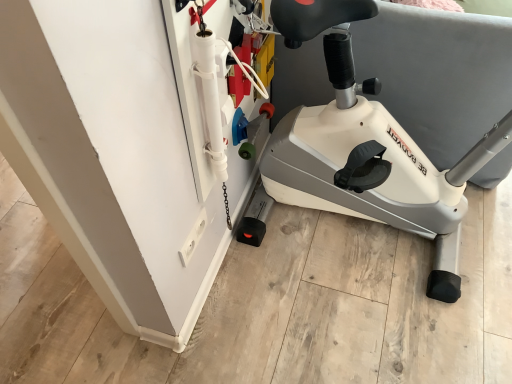
Image resolution: width=512 pixels, height=384 pixels. What do you see at coordinates (367, 149) in the screenshot? I see `white plastic stationary bicycle at center` at bounding box center [367, 149].

You are a GUI agent. You are given a task and a screenshot of the screen. Output one action in this format:
    pyautogui.click(x=<x>, y=<y>)
    Task: Click on the white plastic stationary bicycle at center
    
    Given the screenshot: What is the action you would take?
    pyautogui.click(x=367, y=149)

Image resolution: width=512 pixels, height=384 pixels. Find the location of `white plastic stationary bicycle at center`. white plastic stationary bicycle at center is located at coordinates (367, 149).